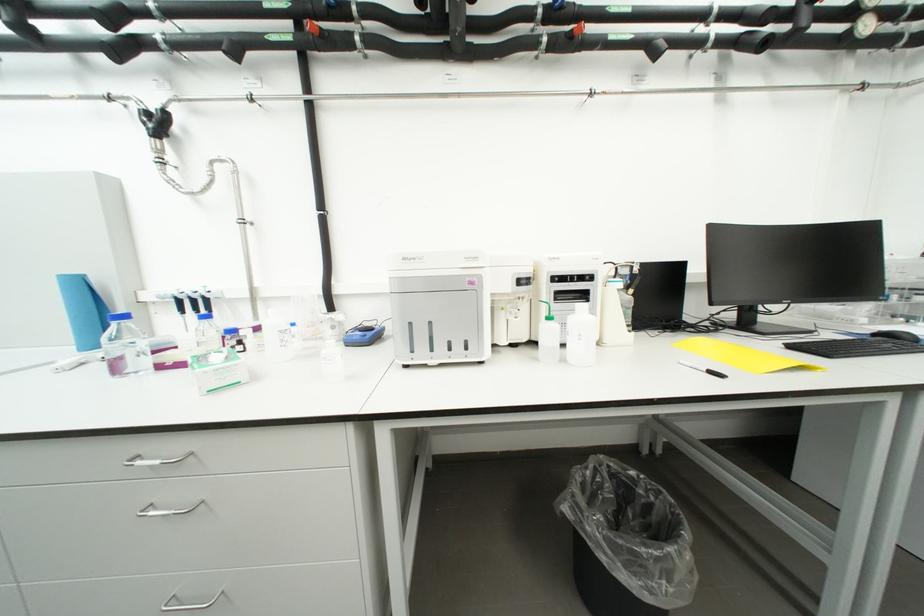
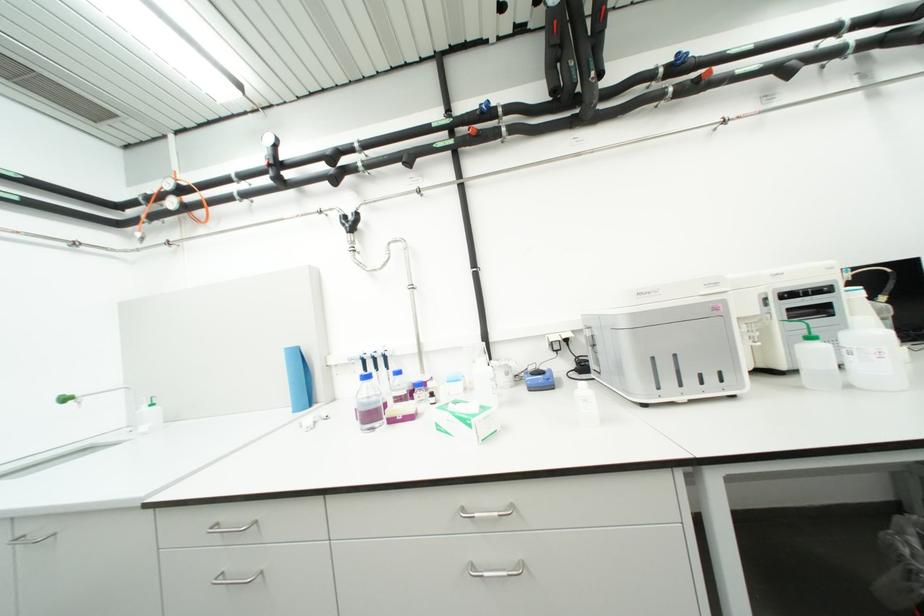
Find the pixel in the second image that matches [83,349] in the first image.

(298, 411)